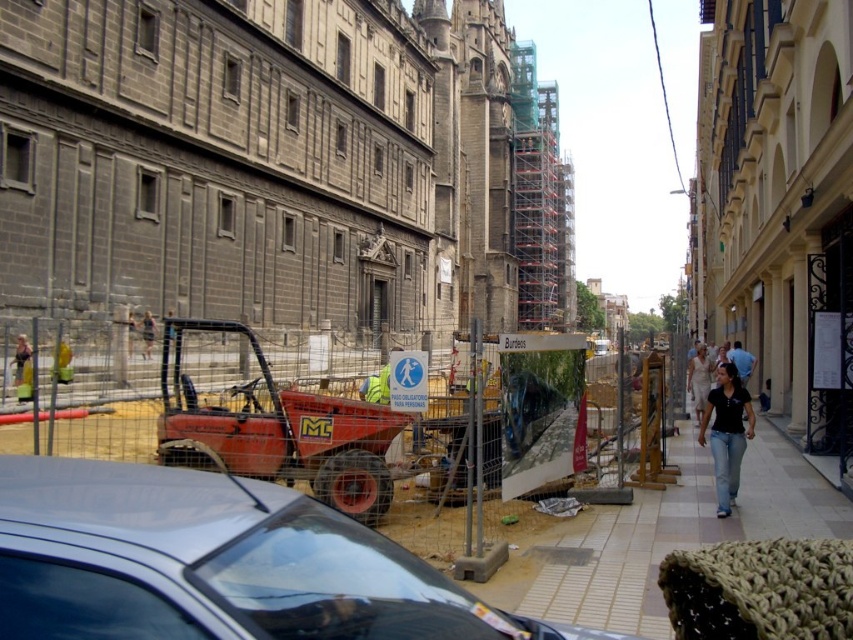
How distant is silver metallic car at center from smooth concrete sidewalk at center?

The distance of silver metallic car at center from smooth concrete sidewalk at center is 16.96 meters.

Does silver metallic car at center have a smaller size compared to smooth concrete sidewalk at center?

No.

Measure the distance between silver metallic car at center and camera.

A distance of 74.37 feet exists between silver metallic car at center and camera.

Find the location of a particular element. This screenshot has width=853, height=640. silver metallic car at center is located at coordinates (213, 563).

Who is higher up, silver metallic car at center or black matte shirt at center?

Positioned higher is black matte shirt at center.

Which of these two, silver metallic car at center or black matte shirt at center, stands shorter?

Standing shorter between the two is black matte shirt at center.

Where is `silver metallic car at center`? silver metallic car at center is located at coordinates (213, 563).

In the scene shown: Is smooth concrete sidewalk at center to the right of black matte shirt at center from the viewer's perspective?

Incorrect, smooth concrete sidewalk at center is not on the right side of black matte shirt at center.

Which is above, smooth concrete sidewalk at center or black matte shirt at center?

black matte shirt at center is higher up.

Is point (619, 509) less distant than point (726, 365)?

Yes, it is in front of point (726, 365).

Locate an element on the screen. smooth concrete sidewalk at center is located at coordinates (676, 532).